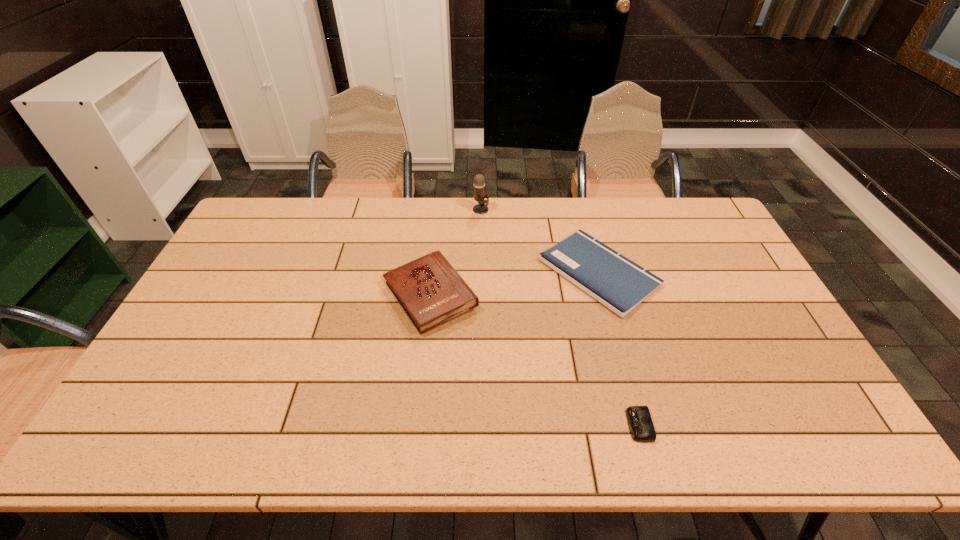
Identify the location of the third closest object to the farthest object. (641, 426).

Identify the location of object that stands as the closest to the microphone. The height and width of the screenshot is (540, 960). (615, 281).

Where is `vacant area that satisfies the following two spatial constraints: 1. on the front side of the paperback book; 2. on the display of the shortest object`? vacant area that satisfies the following two spatial constraints: 1. on the front side of the paperback book; 2. on the display of the shortest object is located at coordinates (640, 425).